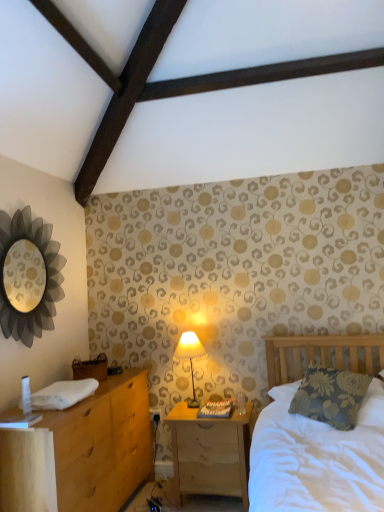
In order to click on free space below matte cream fabric lampshade at center (from a real-world perspective) in this screenshot , I will do coord(194,404).